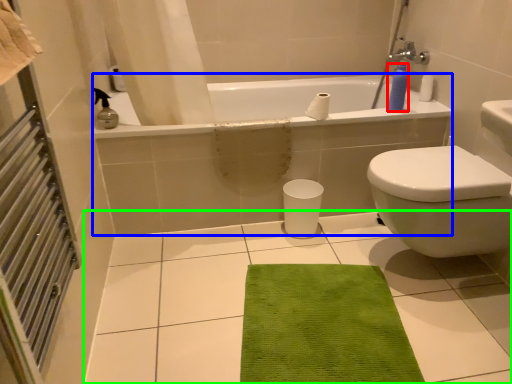
Question: Considering the real-world distances, which object is closest to soap dispenser (highlighted by a red box)? bath (highlighted by a blue box) or ceramic tile (highlighted by a green box).

Choices:
 (A) bath
 (B) ceramic tile

Answer: (A)